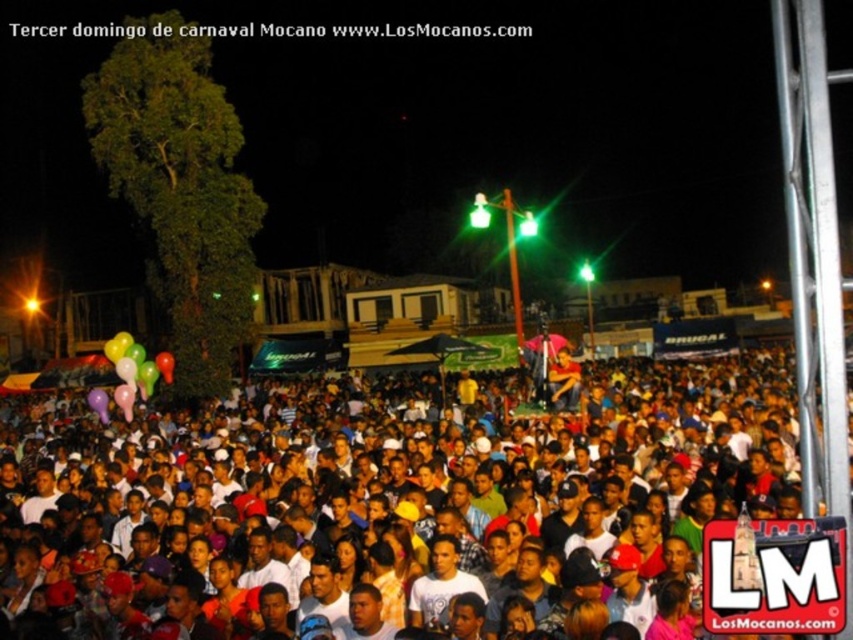
From the picture: Does multicolored balloons at lower center appear over rubber balloons at lower left?

Actually, multicolored balloons at lower center is below rubber balloons at lower left.

Can you confirm if multicolored balloons at lower center is bigger than rubber balloons at lower left?

Indeed, multicolored balloons at lower center has a larger size compared to rubber balloons at lower left.

This screenshot has width=853, height=640. Describe the element at coordinates (415, 512) in the screenshot. I see `multicolored balloons at lower center` at that location.

Locate an element on the screen. multicolored balloons at lower center is located at coordinates (415, 512).